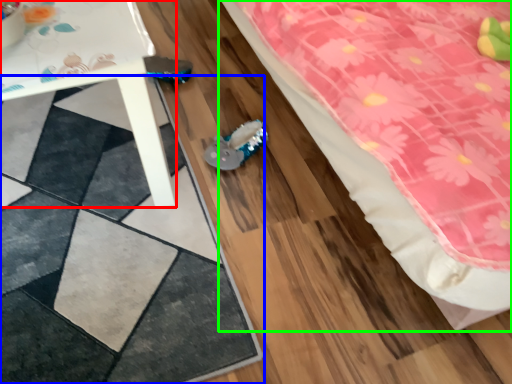
Question: Based on their relative distances, which object is nearer to table (highlighted by a red box)? Choose from square (highlighted by a blue box) and bed (highlighted by a green box).

Choices:
 (A) square
 (B) bed

Answer: (A)